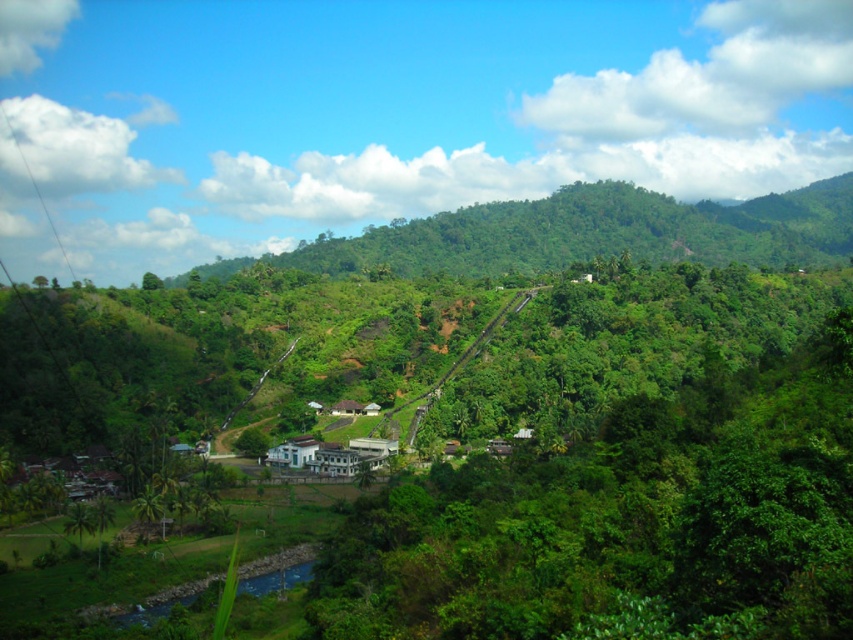
Does point (553, 269) come behind point (297, 440)?

Yes, point (553, 269) is farther from viewer.

Measure the distance from green leafy mountain at center to white concrete building at center.

green leafy mountain at center and white concrete building at center are 332.67 meters apart from each other.

In the scene shown: Measure the distance between point (x=376, y=228) and camera.

Point (x=376, y=228) is 530.94 meters away from camera.

The height and width of the screenshot is (640, 853). What are the coordinates of `green leafy mountain at center` in the screenshot? It's located at (596, 232).